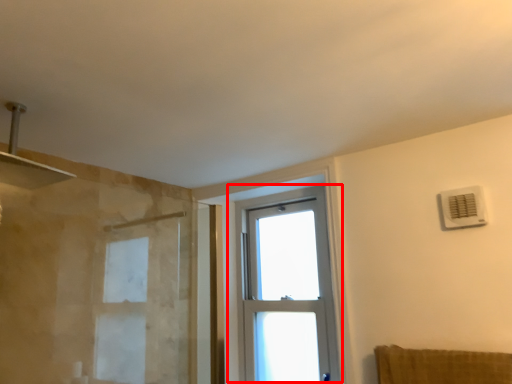
Question: In this image, where is window (annotated by the red box) located relative to air conditioning?

Choices:
 (A) left
 (B) right

Answer: (A)